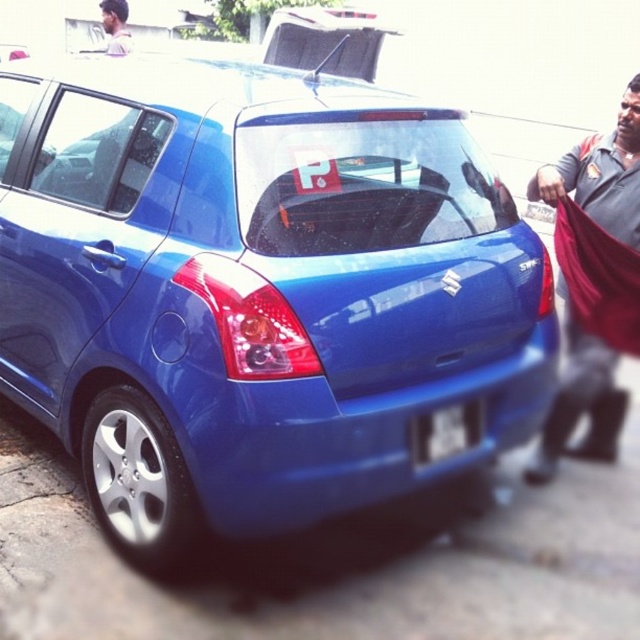
Based on the photo, you are standing in front of a blue Suzuki Swift car parked on a street. You see a point marked at coordinate (253, 291). Which object does this point belong to?

The point at coordinate (253, 291) is on the glossy blue hatchback at center.

You are standing behind the blue Suzuki Swift car and want to walk towards the point that is closer to the front of the car. Which point should you walk towards, point (x=68, y=435) or point (x=579, y=358)?

You should walk towards point (x=68, y=435) because it is in front of point (x=579, y=358), making it closer to the front of the car.

You are driving a car and need to park in the parking lot. You see a glossy blue hatchback at center and a blue fabric at right. Which object is closer to you as you approach the parking spot?

The glossy blue hatchback at center is closer to you because it is positioned in front of the blue fabric at right.